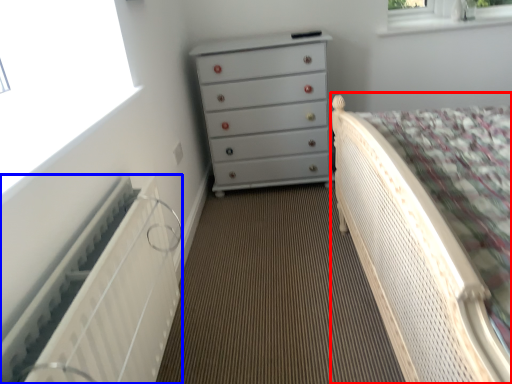
Question: Which point is further to the camera, bed (highlighted by a red box) or radiator (highlighted by a blue box)?

Choices:
 (A) bed
 (B) radiator

Answer: (B)